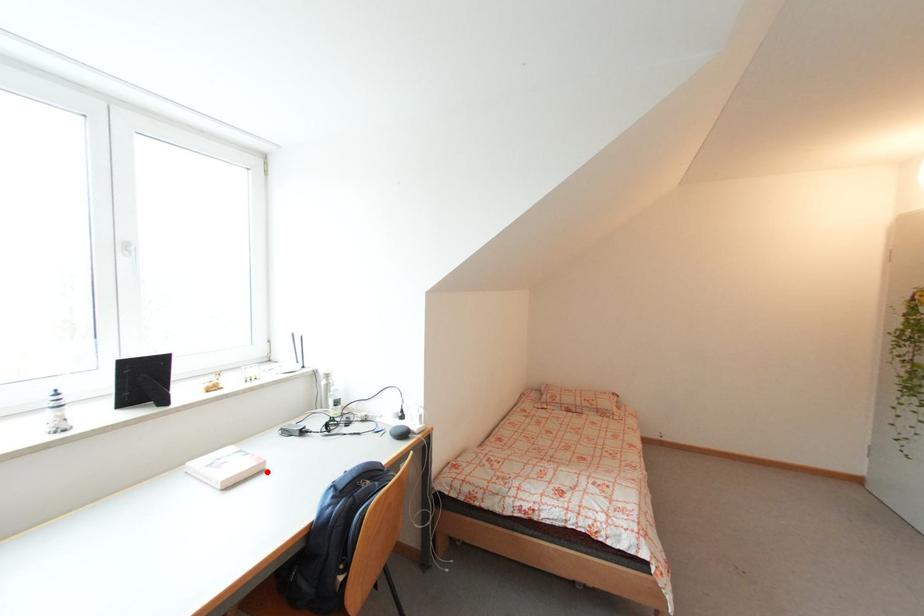
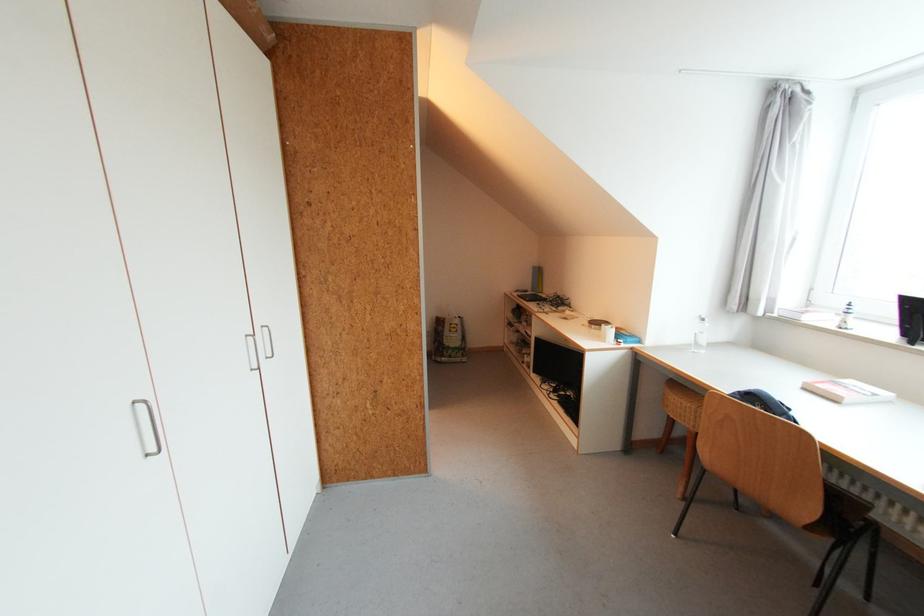
Where in the second image is the point corresponding to the highlighted location from the first image?

(841, 403)